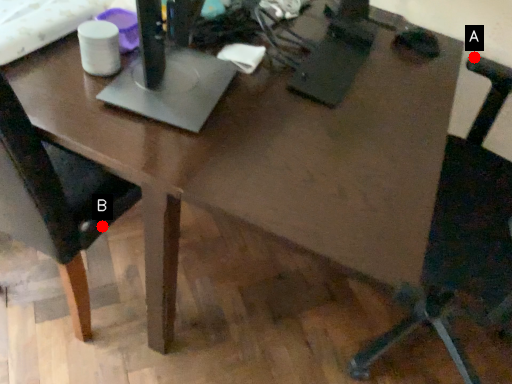
Question: Two points are circled on the image, labeled by A and B beside each circle. Among these points, which one is nearest to the camera?

Choices:
 (A) A is closer
 (B) B is closer

Answer: (B)